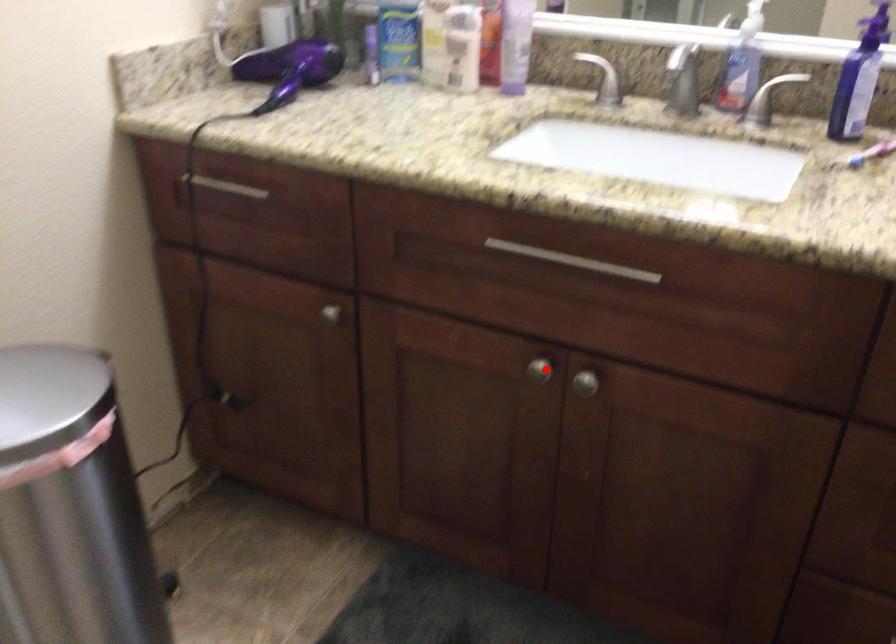
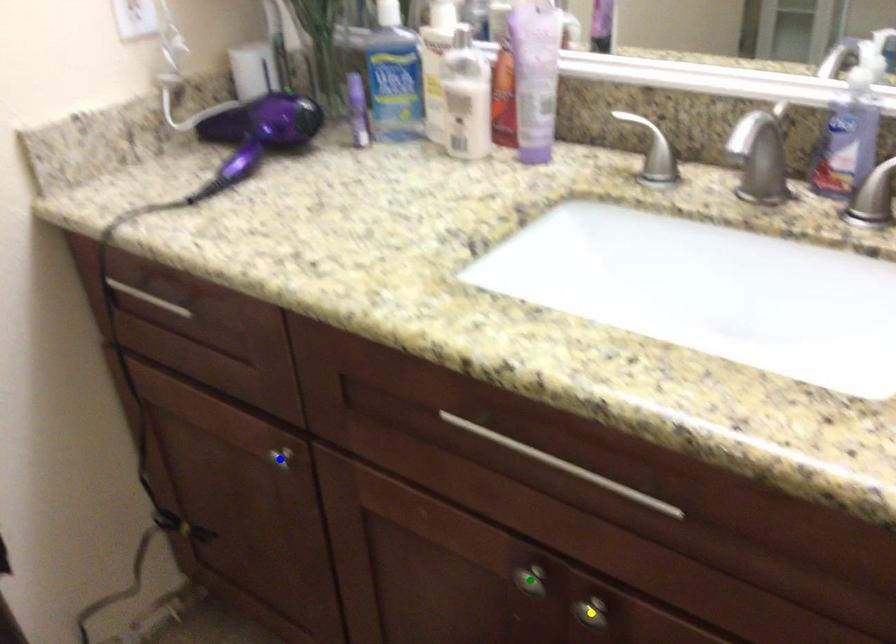
Question: I am providing you with two images of the same scene from different viewpoints. A red point is marked on the first image. You are given multiple points on the second image. Which point in image 2 represents the same 3d spot as the red point in image 1?

Choices:
 (A) blue point
 (B) yellow point
 (C) green point

Answer: (C)